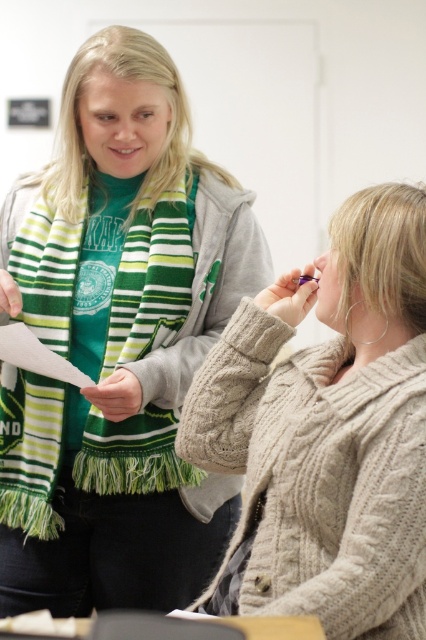
Which is more to the left, green knitted scarf at upper left or cable-knit sweater at center?

From the viewer's perspective, green knitted scarf at upper left appears more on the left side.

Is the position of green knitted scarf at upper left more distant than that of cable-knit sweater at center?

Yes, green knitted scarf at upper left is further from the viewer.

Describe the element at coordinates (117, 342) in the screenshot. I see `green knitted scarf at upper left` at that location.

At what (x,y) coordinates should I click in order to perform the action: click on green knitted scarf at upper left. Please return your answer as a coordinate pair (x, y). Looking at the image, I should click on (117, 342).